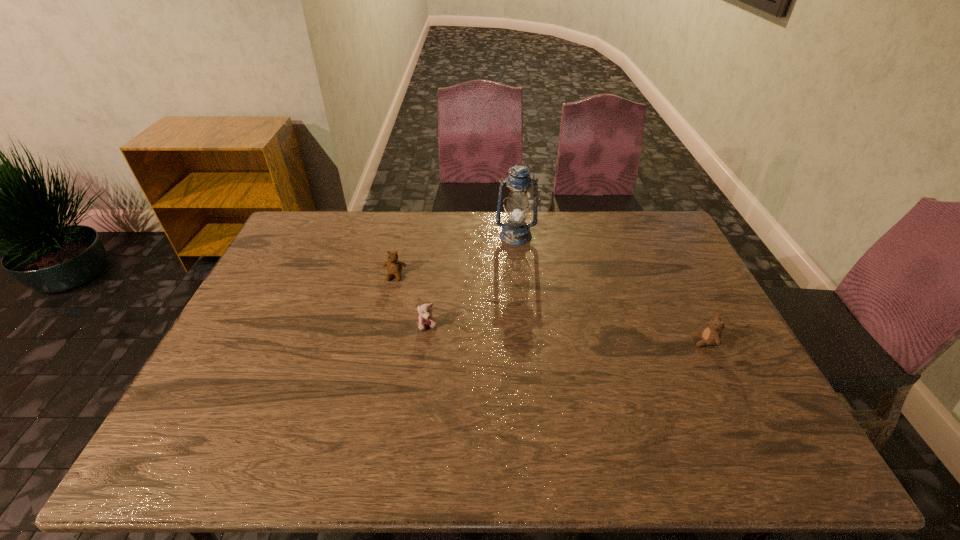
Locate an element on the screen. The width and height of the screenshot is (960, 540). the tallest object is located at coordinates coord(514,232).

Locate an element on the screen. This screenshot has height=540, width=960. the second object from right to left is located at coordinates (514, 232).

Where is `the rightmost teddy bear`? Image resolution: width=960 pixels, height=540 pixels. the rightmost teddy bear is located at coordinates (711, 335).

The height and width of the screenshot is (540, 960). In order to click on the leftmost object in this screenshot , I will do `click(394, 267)`.

What are the coordinates of `the leftmost teddy bear` in the screenshot? It's located at (394, 267).

You are a GUI agent. You are given a task and a screenshot of the screen. Output one action in this format:
    pyautogui.click(x=<x>, y=<y>)
    Task: Click on the second object from left to right
    
    Given the screenshot: What is the action you would take?
    pyautogui.click(x=426, y=318)

At what (x,y) coordinates should I click in order to perform the action: click on vacant space positioned 0.130m on the front-facing side of the third object from left to right. Please return your answer as a coordinate pair (x, y). The image size is (960, 540). Looking at the image, I should click on (519, 269).

Locate an element on the screen. Image resolution: width=960 pixels, height=540 pixels. vacant space positioned 0.140m on the front-facing side of the rightmost object is located at coordinates (641, 341).

Locate an element on the screen. The height and width of the screenshot is (540, 960). blank space located on the front-facing side of the rightmost object is located at coordinates (550, 341).

Find the location of a particular element. free region located 0.080m on the front-facing side of the rightmost object is located at coordinates (663, 341).